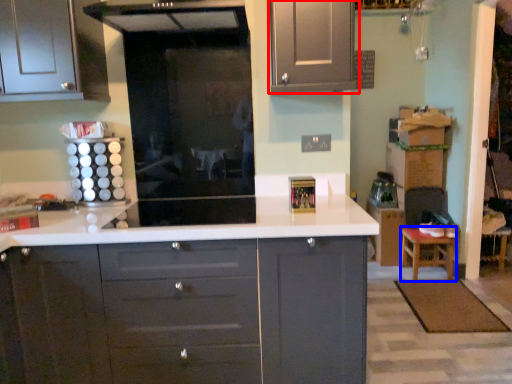
Question: Which of the following is the farthest to the observer, cabinetry (highlighted by a red box) or stool (highlighted by a blue box)?

Choices:
 (A) cabinetry
 (B) stool

Answer: (B)